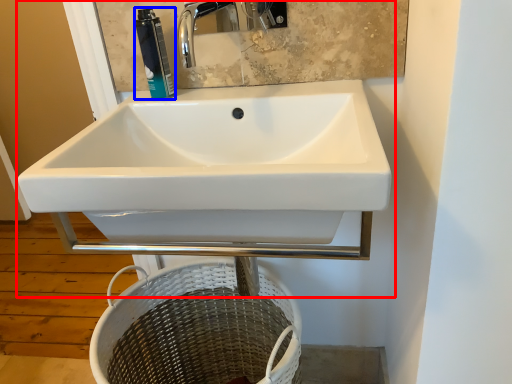
Question: Which point is closer to the camera, sink (highlighted by a red box) or toiletry (highlighted by a blue box)?

Choices:
 (A) sink
 (B) toiletry

Answer: (A)